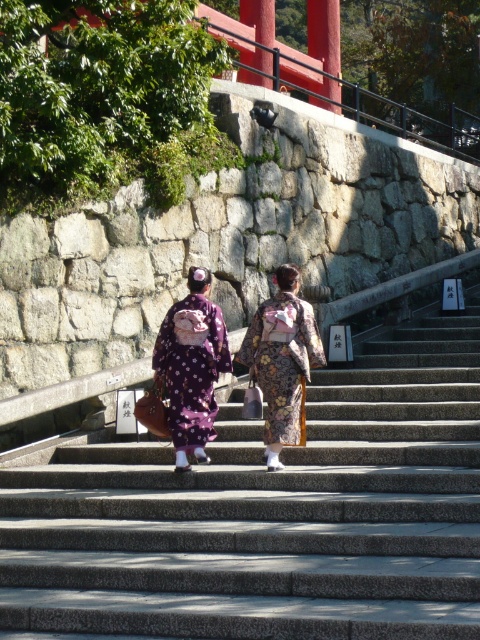
Question: Which object is the farthest from the smooth stone stairs at center?

Choices:
 (A) floral kimono at center
 (B) purple satin kimono at center

Answer: (B)

Question: Which object is the closest to the purple satin kimono at center?

Choices:
 (A) floral kimono at center
 (B) smooth stone stairs at center

Answer: (A)

Question: Can you confirm if smooth stone stairs at center is wider than floral kimono at center?

Choices:
 (A) yes
 (B) no

Answer: (B)

Question: Does smooth stone stairs at center appear over purple satin kimono at center?

Choices:
 (A) yes
 (B) no

Answer: (B)

Question: Which object is positioned closest to the purple satin kimono at center?

Choices:
 (A) smooth stone stairs at center
 (B) floral kimono at center

Answer: (B)

Question: Is purple satin kimono at center in front of floral kimono at center?

Choices:
 (A) no
 (B) yes

Answer: (B)